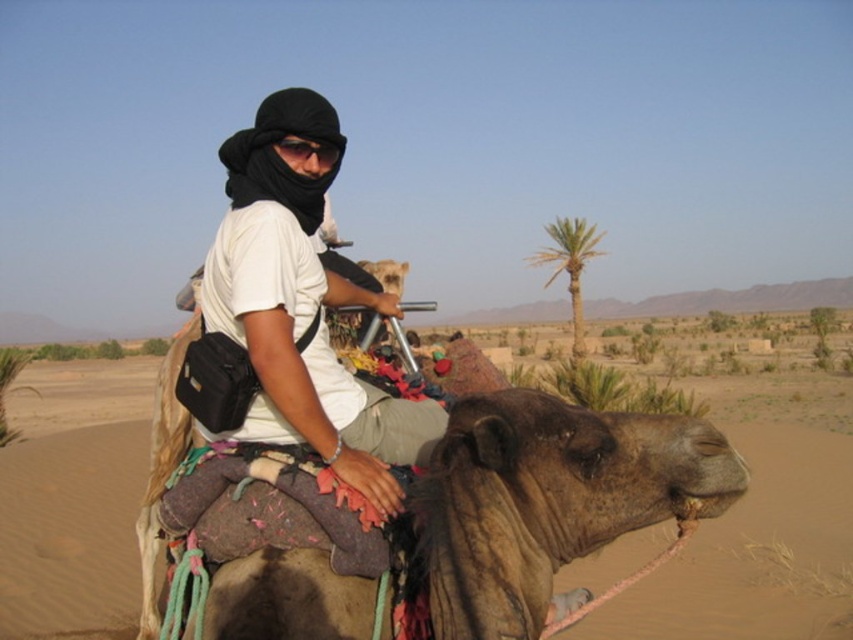
Which of these two, white matte shirt at center or green leafy palm tree at upper right, stands shorter?

With less height is white matte shirt at center.

Does white matte shirt at center appear on the right side of green leafy palm tree at upper right?

In fact, white matte shirt at center is to the left of green leafy palm tree at upper right.

Where is `white matte shirt at center`? white matte shirt at center is located at coordinates (299, 310).

Locate an element on the screen. This screenshot has width=853, height=640. white matte shirt at center is located at coordinates (299, 310).

Which is below, white matte shirt at center or black matte goggles at center?

white matte shirt at center is below.

The width and height of the screenshot is (853, 640). Find the location of `white matte shirt at center`. white matte shirt at center is located at coordinates (299, 310).

The width and height of the screenshot is (853, 640). In order to click on white matte shirt at center in this screenshot , I will do `click(299, 310)`.

Who is higher up, brown textured camel at center or white matte shirt at center?

white matte shirt at center is higher up.

Is point (836, 499) positioned in front of point (291, 240)?

No, (836, 499) is behind (291, 240).

You are a GUI agent. You are given a task and a screenshot of the screen. Output one action in this format:
    pyautogui.click(x=<x>, y=<y>)
    Task: Click on the brown textured camel at center
    
    Given the screenshot: What is the action you would take?
    pyautogui.click(x=756, y=550)